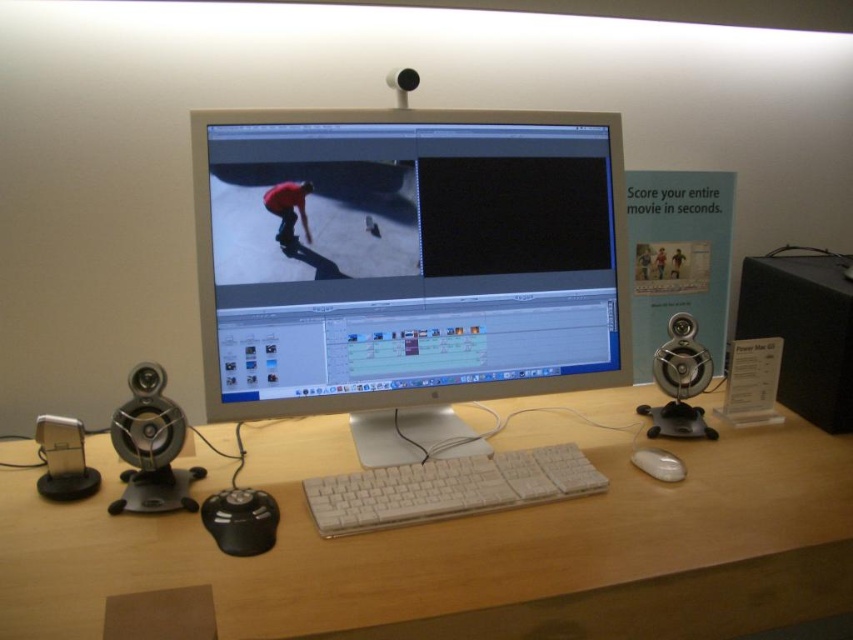
You are standing in front of the computer workstation setup. The point at coordinates (x=468, y=547) is where the white wood computer desk at center is located. If you want to place a new monitor on the desk, would the coordinates be a good spot for it?

The point at coordinates (x=468, y=547) represents the white wood computer desk at center. Since this point is the center of the desk, placing a new monitor here might be ideal as it is centrally located and likely has enough space.

You are a person with a 24 inch laptop that you want to place on the desk. The desk has enough space, but you need to ensure that the laptop is placed at least 30 inches away from the white plastic monitor at center. Can you place your laptop on the desk in this setup?

The distance between the white plastic monitor at center and the viewer is 36.49 inches. Since the required minimum distance is 30 inches, you can place your laptop on the desk as the existing distance already exceeds the requirement.